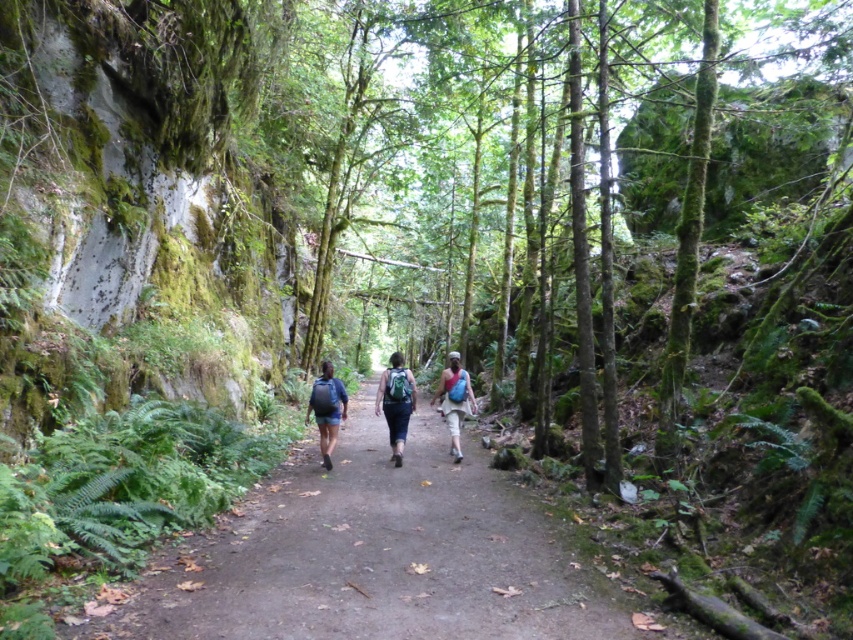
In the scene shown: Is brown dirt trail at center below matte blue backpacks at center?

Indeed, brown dirt trail at center is positioned under matte blue backpacks at center.

Who is shorter, brown dirt trail at center or matte blue backpacks at center?

With less height is brown dirt trail at center.

In order to click on brown dirt trail at center in this screenshot , I will do `click(373, 556)`.

Where is `brown dirt trail at center`? This screenshot has height=640, width=853. brown dirt trail at center is located at coordinates (373, 556).

What do you see at coordinates (328, 410) in the screenshot? The image size is (853, 640). I see `matte blue backpack at center` at bounding box center [328, 410].

Does matte blue backpack at center come in front of blue fabric backpack at center?

Yes.

The width and height of the screenshot is (853, 640). Find the location of `matte blue backpack at center`. matte blue backpack at center is located at coordinates (328, 410).

Is matte blue backpacks at center to the right of matte blue backpack at center from the viewer's perspective?

Indeed, matte blue backpacks at center is positioned on the right side of matte blue backpack at center.

The image size is (853, 640). What do you see at coordinates (396, 403) in the screenshot?
I see `matte blue backpacks at center` at bounding box center [396, 403].

The height and width of the screenshot is (640, 853). Describe the element at coordinates (396, 403) in the screenshot. I see `matte blue backpacks at center` at that location.

You are a GUI agent. You are given a task and a screenshot of the screen. Output one action in this format:
    pyautogui.click(x=<x>, y=<y>)
    Task: Click on the matte blue backpacks at center
    
    Given the screenshot: What is the action you would take?
    pyautogui.click(x=396, y=403)